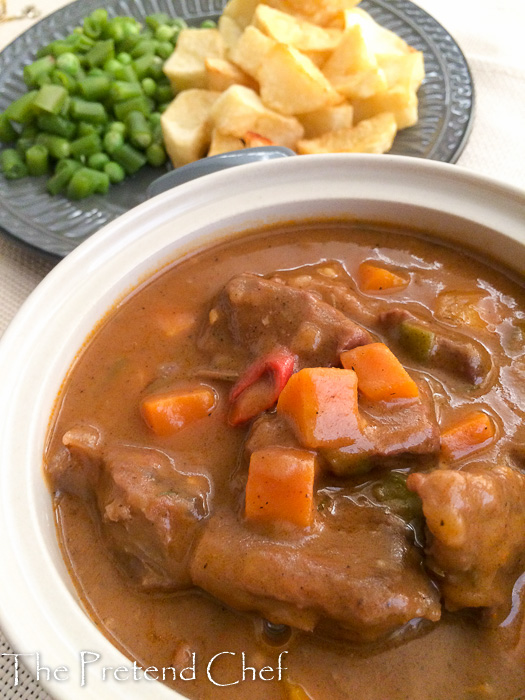
Locate an element on the screen. The height and width of the screenshot is (700, 525). white plate is located at coordinates [97, 267].